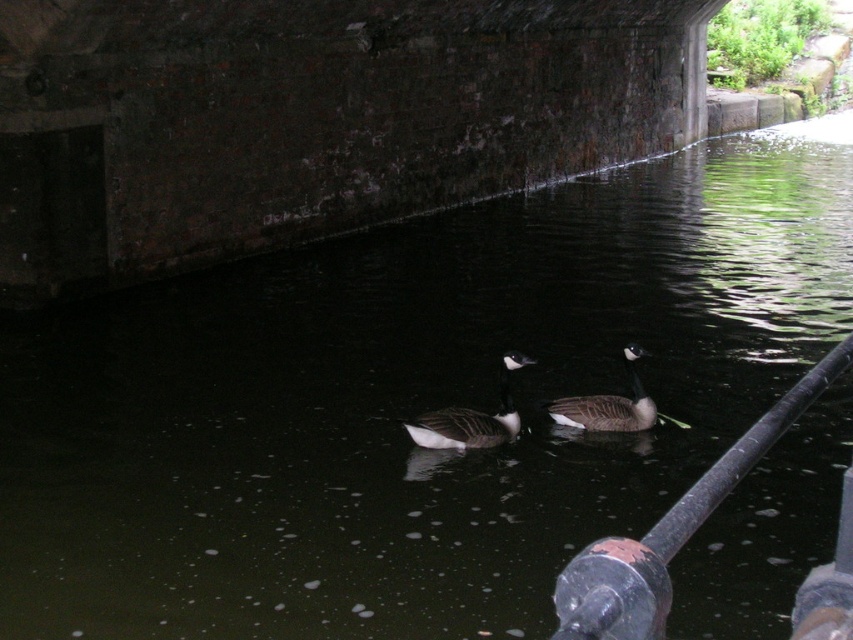
Between point (680, 522) and point (587, 419), which one is positioned in front?

Point (680, 522)

The image size is (853, 640). I want to click on black metal rail at lower right, so click(671, 531).

Is black metal rail at lower right below white matte duck at center?

Yes.

Does black metal rail at lower right come in front of white matte duck at center?

Yes, black metal rail at lower right is in front of white matte duck at center.

What do you see at coordinates (671, 531) in the screenshot? I see `black metal rail at lower right` at bounding box center [671, 531].

Identify the location of black metal rail at lower right. This screenshot has width=853, height=640. (671, 531).

Locate an element on the screen. Image resolution: width=853 pixels, height=640 pixels. white matte duck at center is located at coordinates (471, 419).

Who is more distant from viewer, [451,413] or [596,397]?

Positioned behind is point [596,397].

Is point (520, 358) less distant than point (583, 429)?

Yes, it is in front of point (583, 429).

At what (x,y) coordinates should I click in order to perform the action: click on white matte duck at center. Please return your answer as a coordinate pair (x, y). Looking at the image, I should click on (471, 419).